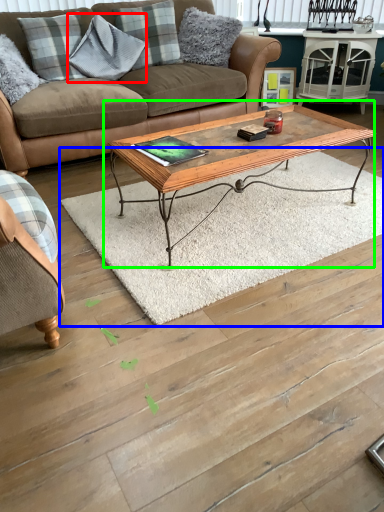
Question: Considering the real-world distances, which object is farthest from pillow (highlighted by a red box)? mat (highlighted by a blue box) or coffee table (highlighted by a green box)?

Choices:
 (A) mat
 (B) coffee table

Answer: (A)